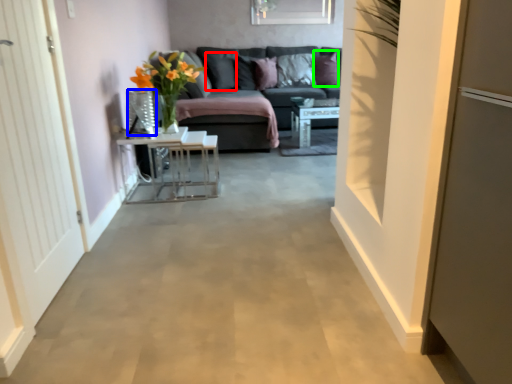
Question: Which is nearer to the pillow (highlighted by a red box)? glass vase (highlighted by a blue box) or pillow (highlighted by a green box).

Choices:
 (A) glass vase
 (B) pillow

Answer: (B)